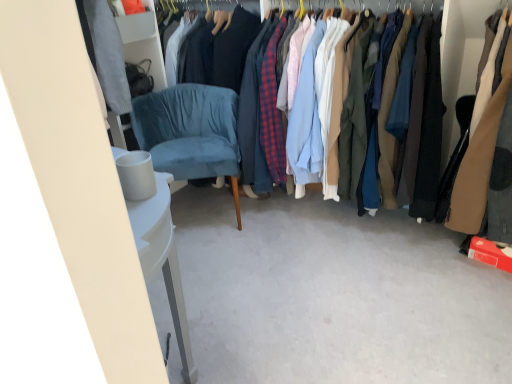
Question: Would you say white matte trash bin at lower left is to the left or to the right of matte cotton shirts at center, arranged as the 1th clothing when viewed from the left, in the picture?

Choices:
 (A) right
 (B) left

Answer: (B)

Question: In terms of size, does white matte trash bin at lower left appear bigger or smaller than matte cotton shirts at center, which is counted as the 2th clothing, starting from the right?

Choices:
 (A) small
 (B) big

Answer: (A)

Question: Which object is positioned closest to the brown leather jacket at right, which appears as the first clothing when viewed from the right?

Choices:
 (A) matte cotton shirts at center, which is counted as the 2th clothing, starting from the right
 (B) white matte trash bin at lower left
 (C) velvet blue armchair at center-left

Answer: (A)

Question: Based on their relative distances, which object is farther from the white matte trash bin at lower left?

Choices:
 (A) velvet blue armchair at center-left
 (B) brown leather jacket at right, which appears as the first clothing when viewed from the right
 (C) matte cotton shirts at center, which is counted as the 2th clothing, starting from the right

Answer: (C)